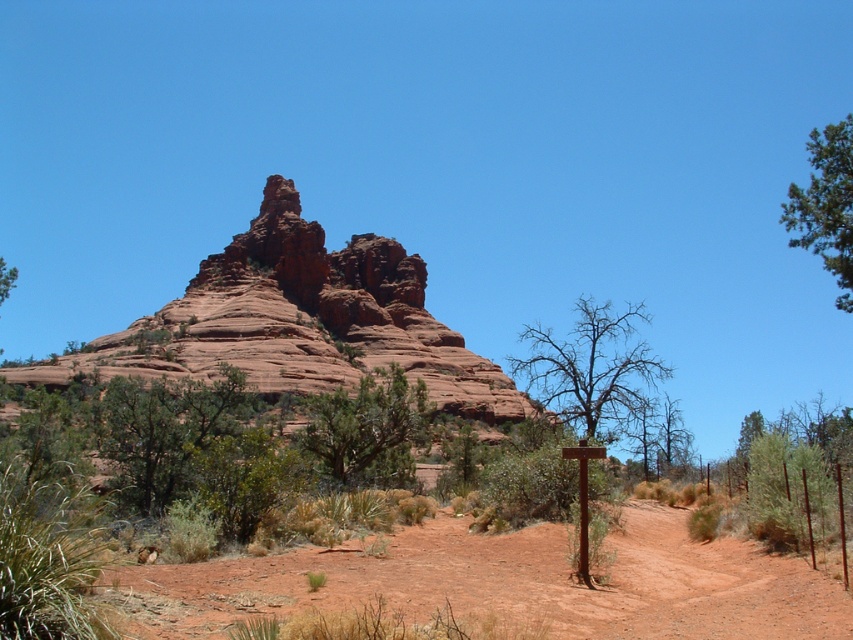
Does dusty red dirt track at center have a greater width compared to green leafy tree at upper left?

No.

Which is in front, point (166, 579) or point (4, 291)?

Point (166, 579) is more forward.

I want to click on dusty red dirt track at center, so (x=502, y=584).

Which is below, dusty red dirt track at center or green textured bush at center?

dusty red dirt track at center is lower down.

Consider the image. Between dusty red dirt track at center and green textured bush at center, which one is positioned higher?

green textured bush at center

At what (x,y) coordinates should I click in order to perform the action: click on dusty red dirt track at center. Please return your answer as a coordinate pair (x, y). This screenshot has height=640, width=853. Looking at the image, I should click on (502, 584).

Locate an element on the screen. dusty red dirt track at center is located at coordinates (502, 584).

Which is in front, point (132, 326) or point (0, 289)?

Point (0, 289) is more forward.

How far apart are reddish-brown sandstone rock formation at center and green leafy tree at upper left?

reddish-brown sandstone rock formation at center and green leafy tree at upper left are 171.48 feet apart from each other.

Does point (352, 280) come in front of point (0, 305)?

Yes.

The width and height of the screenshot is (853, 640). I want to click on reddish-brown sandstone rock formation at center, so click(x=299, y=321).